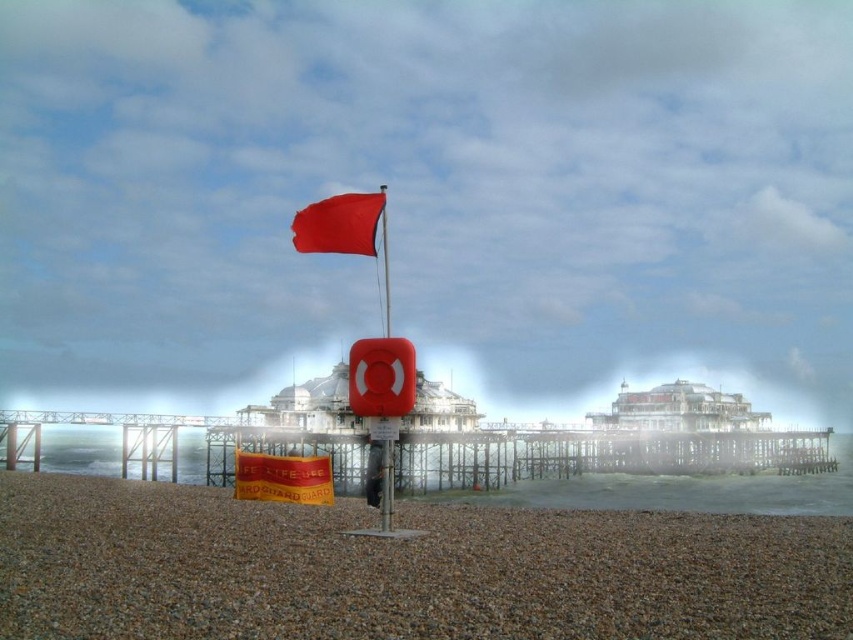
Question: Can you confirm if matte red flag at center is wider than smooth plastic flag at center?

Choices:
 (A) no
 (B) yes

Answer: (B)

Question: Can you confirm if smooth pebble beach at center is wider than matte red flag at center?

Choices:
 (A) yes
 (B) no

Answer: (A)

Question: Which object appears farthest from the camera in this image?

Choices:
 (A) matte red flag at center
 (B) smooth plastic flag at center

Answer: (A)

Question: Which of these objects is positioned farthest from the smooth pebble beach at center?

Choices:
 (A) smooth plastic flag at center
 (B) matte red flag at center

Answer: (B)

Question: Which object is closer to the camera taking this photo?

Choices:
 (A) matte red flag at center
 (B) smooth pebble beach at center
 (C) smooth plastic flag at center

Answer: (B)

Question: Considering the relative positions of smooth pebble beach at center and smooth plastic flag at center in the image provided, where is smooth pebble beach at center located with respect to smooth plastic flag at center?

Choices:
 (A) left
 (B) right

Answer: (B)